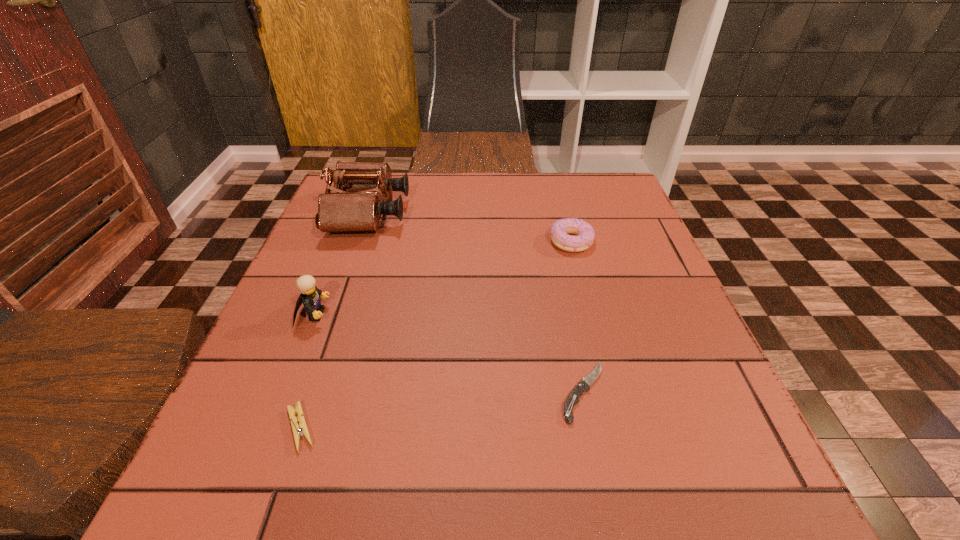
Find the location of a particular element. The height and width of the screenshot is (540, 960). vacant space at the right edge of the desktop is located at coordinates (619, 240).

The width and height of the screenshot is (960, 540). Find the location of `free location at the far right corner of the desktop`. free location at the far right corner of the desktop is located at coordinates (581, 210).

Where is `free space at the near right corner of the desktop`? The width and height of the screenshot is (960, 540). free space at the near right corner of the desktop is located at coordinates (677, 459).

Find the location of `free space that is in between the pocketknife and the Lego`. free space that is in between the pocketknife and the Lego is located at coordinates (448, 353).

Where is `vacant area between the pocketknife and the tallest object`? This screenshot has height=540, width=960. vacant area between the pocketknife and the tallest object is located at coordinates (476, 303).

I want to click on free space that is in between the third tallest object and the fourth shortest object, so click(x=443, y=278).

I want to click on vacant point located between the third tallest object and the binoculars, so click(470, 227).

What are the coordinates of `vacant area between the binoculars and the fourth shortest object` in the screenshot? It's located at tap(341, 264).

Where is `empty location between the doughnut and the third nearest object`? This screenshot has width=960, height=540. empty location between the doughnut and the third nearest object is located at coordinates (443, 278).

Find the location of `empty space that is in between the doughnut and the clothespin`. empty space that is in between the doughnut and the clothespin is located at coordinates (436, 335).